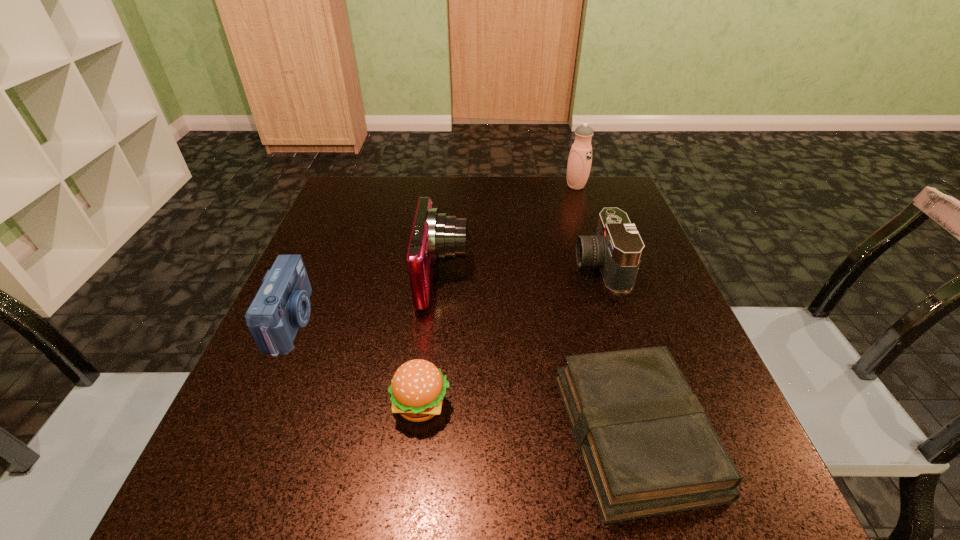
Locate an element on the screen. The image size is (960, 540). camera that is the second closest to the second tallest object is located at coordinates pos(617,248).

Identify which camera is the closest to the leftmost object. Please provide its 2D coordinates. Your answer should be formatted as a tuple, i.e. [(x, y)], where the tuple contains the x and y coordinates of a point satisfying the conditions above.

[(435, 237)]

Identify the location of vacant point that satisfies the following two spatial constraints: 1. on the front-facing side of the shortest object; 2. on the right side of the tallest camera. (427, 433).

Identify the location of free spot that satisfies the following two spatial constraints: 1. on the lens of the leftmost object; 2. on the right side of the second shortest object. (256, 405).

In order to click on vacant space that satisfies the following two spatial constraints: 1. on the front side of the thermos bottle; 2. on the front-facing side of the second camera from left to right in this screenshot , I will do `click(606, 278)`.

This screenshot has width=960, height=540. Find the location of `free location that satisfies the following two spatial constraints: 1. on the front-facing side of the rightmost camera; 2. on the front side of the book`. free location that satisfies the following two spatial constraints: 1. on the front-facing side of the rightmost camera; 2. on the front side of the book is located at coordinates (656, 433).

Where is `vacant area in the image that satisfies the following two spatial constraints: 1. on the front side of the farthest object; 2. on the front-facing side of the rightmost camera`? vacant area in the image that satisfies the following two spatial constraints: 1. on the front side of the farthest object; 2. on the front-facing side of the rightmost camera is located at coordinates (602, 266).